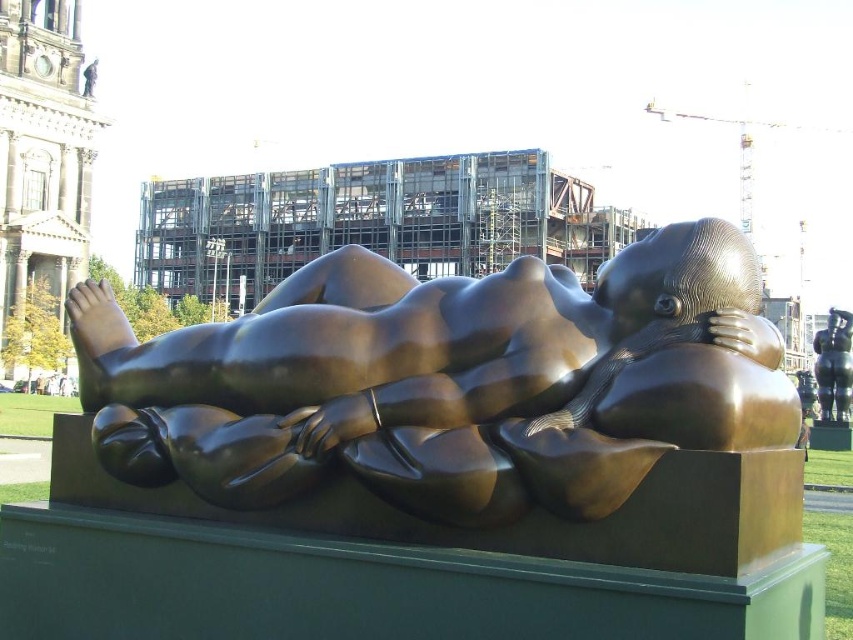
Question: Does bronze sculpture at center have a smaller size compared to bronze figure at center?

Choices:
 (A) no
 (B) yes

Answer: (A)

Question: Among these points, which one is farthest from the camera?

Choices:
 (A) (753, 369)
 (B) (845, 417)

Answer: (B)

Question: In this image, where is bronze sculpture at center located relative to bronze figure at center?

Choices:
 (A) right
 (B) left

Answer: (B)

Question: Is bronze sculpture at center in front of bronze figure at center?

Choices:
 (A) no
 (B) yes

Answer: (B)